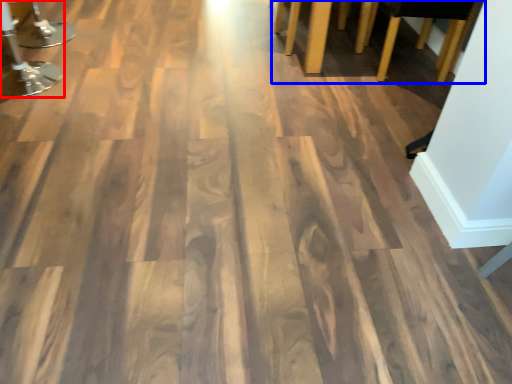
Question: Which of the following is the closest to the observer, furniture (highlighted by a red box) or furniture (highlighted by a blue box)?

Choices:
 (A) furniture
 (B) furniture

Answer: (A)